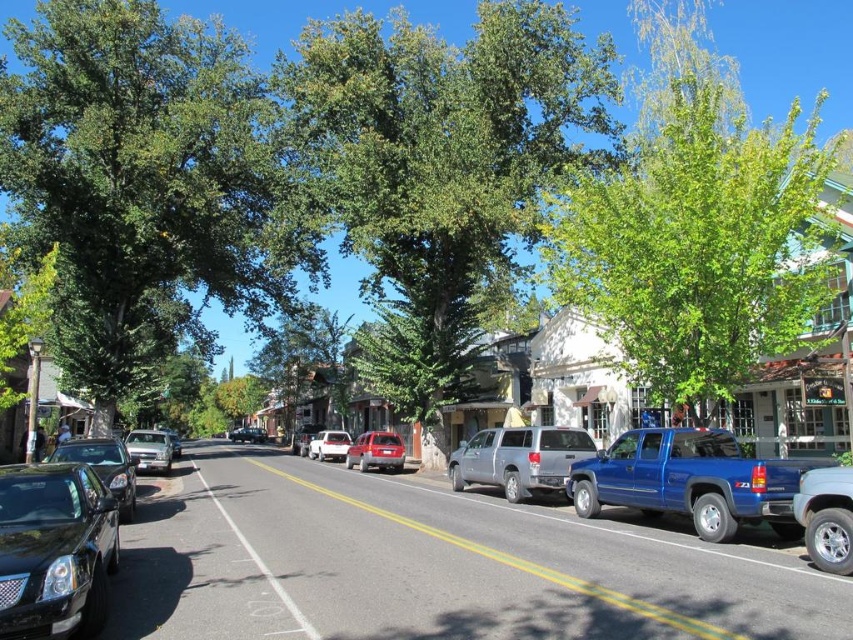
You are a delivery person trying to park your van between the satin red suv at center and the silver metallic sedan at left. Can you park your van there if the space between them is narrower than your van?

The satin red suv at center is positioned under the silver metallic sedan at left, which means the space between them might be too narrow for the van to park. The van should look for a wider space.

You are standing at the point with coordinates point (78, 349) and want to walk to the point with coordinates point (160, 461). Which direction should you face to walk towards your destination?

You should face the direction towards point (160, 461), which is in front of point (78, 349).

You are a delivery driver who needs to park your truck next to the green leafy tree at left and the silver metallic sedan at left. Which vehicle can you park closer to the tree without blocking the sidewalk?

The silver metallic sedan at left can be parked closer to the green leafy tree at left because it is smaller in size than the tree.